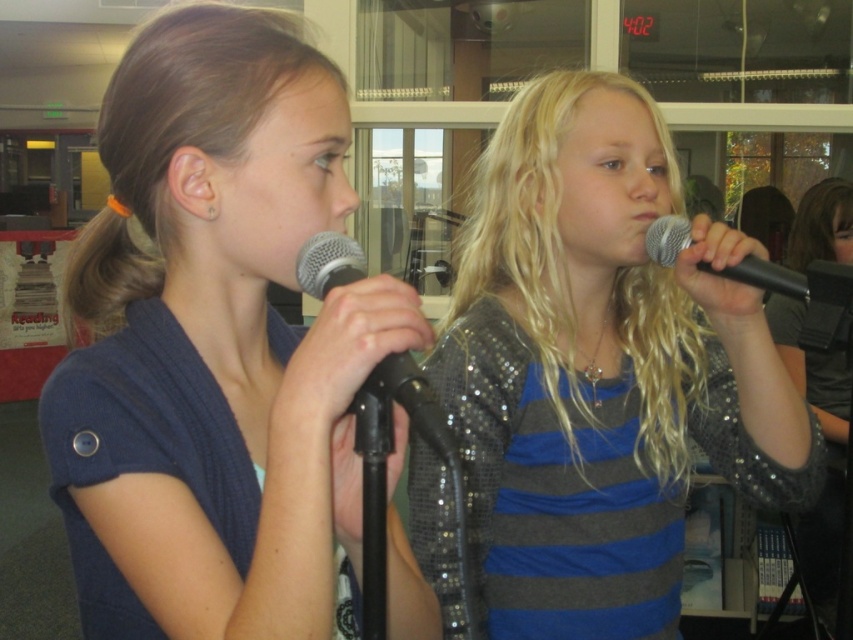
Question: Which point appears closest to the camera in this image?

Choices:
 (A) (831, 552)
 (B) (761, 269)

Answer: (B)

Question: Which object is farther from the camera taking this photo?

Choices:
 (A) silver metallic microphone at center
 (B) silver metallic microphone at right
 (C) shiny sequined top at center

Answer: (B)

Question: Does silver metallic microphone at center have a larger size compared to silver metallic microphone at right?

Choices:
 (A) yes
 (B) no

Answer: (B)

Question: Can you confirm if matte blue shirt at left is positioned below silver metallic microphone at center?

Choices:
 (A) no
 (B) yes

Answer: (A)

Question: Does shiny sequined top at center have a smaller size compared to silver metallic microphone at center?

Choices:
 (A) yes
 (B) no

Answer: (B)

Question: Which point appears farthest from the camera in this image?

Choices:
 (A) (389, 356)
 (B) (660, 257)
 (C) (625, 147)
 (D) (236, 604)

Answer: (C)